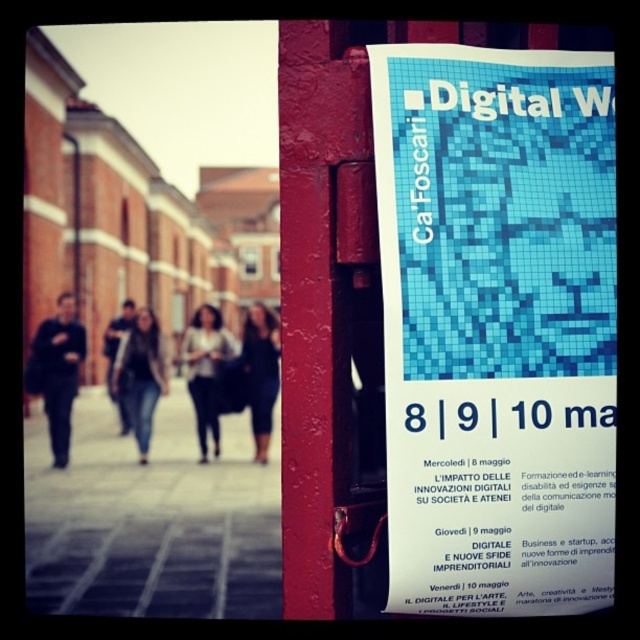
Who is higher up, dark gray sweater at center or jeans at center?

dark gray sweater at center is higher up.

Can you confirm if dark gray sweater at center is positioned below jeans at center?

Incorrect, dark gray sweater at center is not positioned below jeans at center.

Between point (189, 387) and point (157, 380), which one is positioned in front?

Positioned in front is point (189, 387).

This screenshot has height=640, width=640. Find the location of `dark gray sweater at center`. dark gray sweater at center is located at coordinates (205, 371).

Can you confirm if dark gray sweater at left is thinner than dark gray sweater at center?

Indeed, dark gray sweater at left has a lesser width compared to dark gray sweater at center.

Is dark gray sweater at left above dark gray sweater at center?

Yes, dark gray sweater at left is above dark gray sweater at center.

Which is behind, point (76, 355) or point (198, 410)?

The point (76, 355) is behind.

The image size is (640, 640). Identify the location of dark gray sweater at left. (58, 371).

Is point (385, 280) farther from viewer compared to point (161, 369)?

That is False.

Based on the photo, which is below, blue mosaic poster at right or jeans at center?

jeans at center

Is point (440, 342) positioned behind point (141, 392)?

No, (440, 342) is in front of (141, 392).

Identify the location of blue mosaic poster at right. (497, 326).